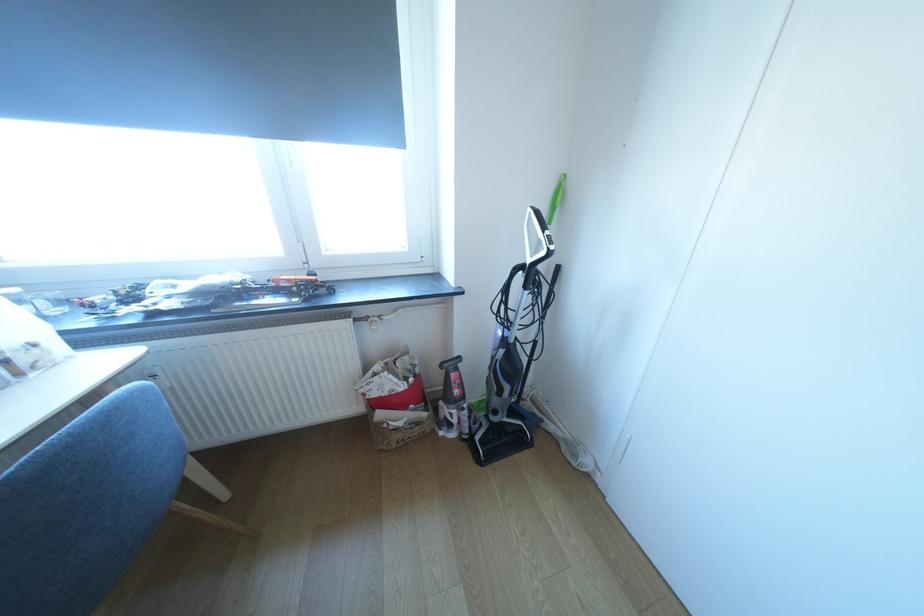
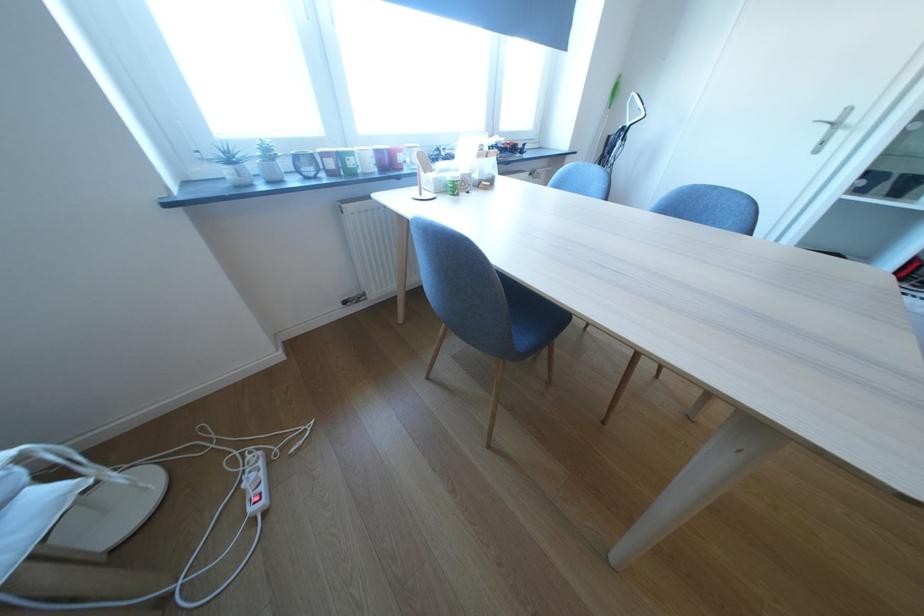
Consider the image. In a continuous first-person perspective shot, in which direction is the camera moving?

The cameraman walked toward left, backward.